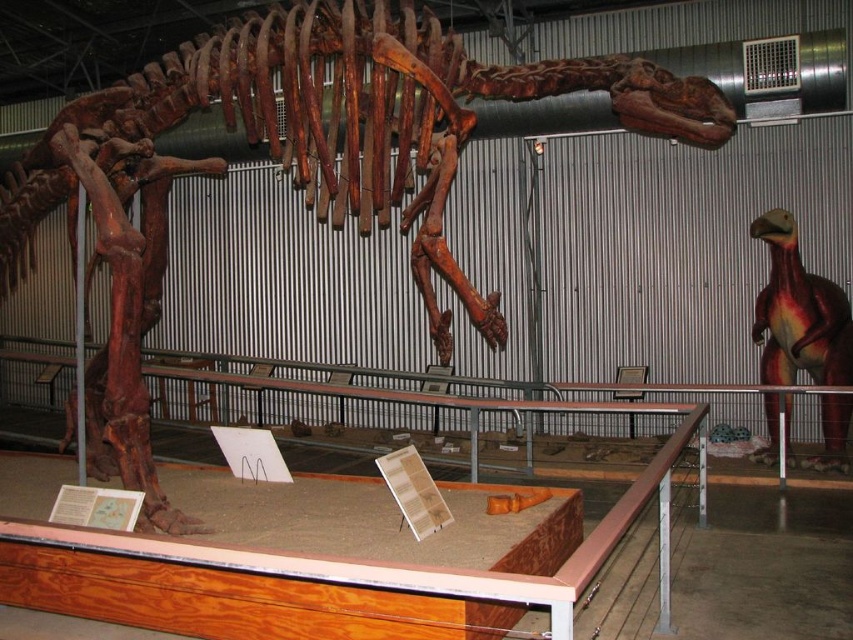
Question: Which point appears farthest from the camera in this image?

Choices:
 (A) (312, 19)
 (B) (775, 369)

Answer: (B)

Question: Can you confirm if wooden dinosaur skeleton at center is positioned to the left of smooth red dinosaur at right?

Choices:
 (A) yes
 (B) no

Answer: (A)

Question: Which point is closer to the camera?

Choices:
 (A) wooden dinosaur skeleton at center
 (B) smooth red dinosaur at right

Answer: (A)

Question: Does wooden dinosaur skeleton at center appear over smooth red dinosaur at right?

Choices:
 (A) no
 (B) yes

Answer: (B)

Question: Considering the relative positions of wooden dinosaur skeleton at center and smooth red dinosaur at right in the image provided, where is wooden dinosaur skeleton at center located with respect to smooth red dinosaur at right?

Choices:
 (A) right
 (B) left

Answer: (B)

Question: Among these objects, which one is nearest to the camera?

Choices:
 (A) wooden dinosaur skeleton at center
 (B) smooth red dinosaur at right

Answer: (A)